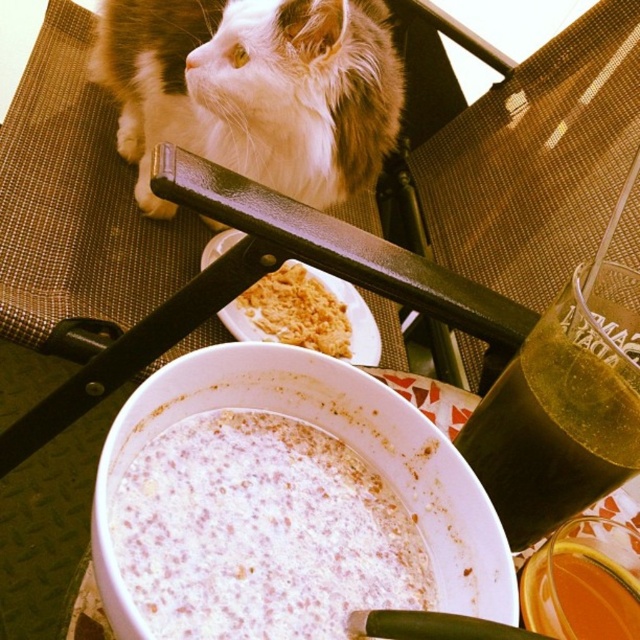
You are a small robot with a 12 inch arm reach. You are standing at the edge of the table and want to pick up the white creamy soup at center. Can your arm reach it?

The white creamy soup at center is 14.54 inches away from the viewer, which is beyond the robot arm reach of 12 inches. The robot cannot reach the white creamy soup at center.

You are a photographer trying to capture the white fluffy cat at upper left and the translucent amber liquid at lower right in the same frame. If you want to ensure both are fully visible without cropping, which object should you focus on to maintain their proportions?

The white fluffy cat at upper left is larger in width than the translucent amber liquid at lower right, so you should focus on the white fluffy cat at upper left to maintain their proportions.